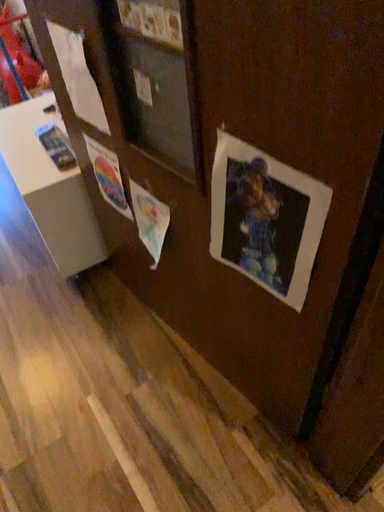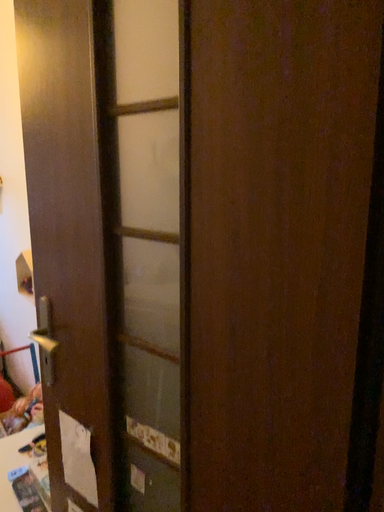
Question: How did the camera likely rotate when shooting the video?

Choices:
 (A) rotated left
 (B) rotated right

Answer: (B)